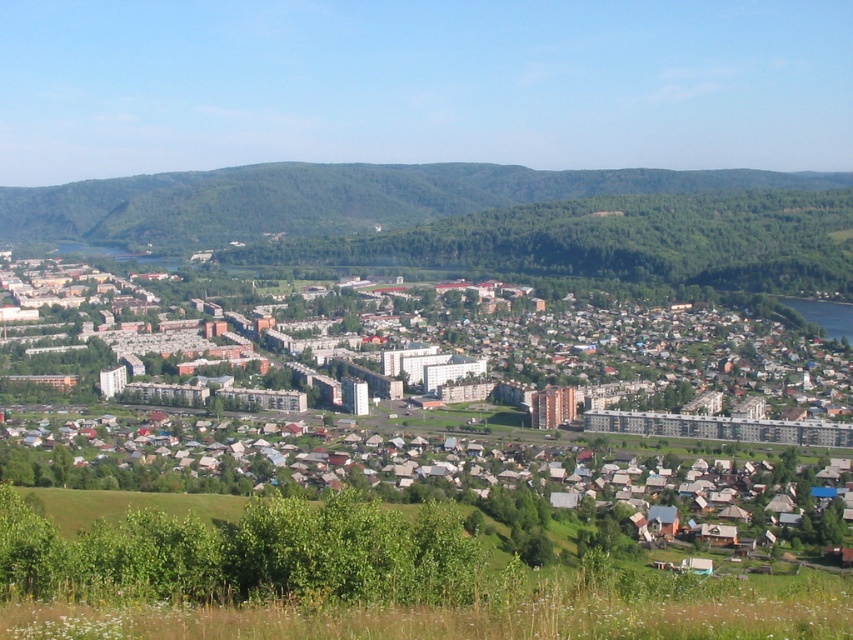
Who is taller, multicolored residential buildings at center or green forested mountain at upper center?

Standing taller between the two is multicolored residential buildings at center.

The height and width of the screenshot is (640, 853). What do you see at coordinates (466, 417) in the screenshot?
I see `multicolored residential buildings at center` at bounding box center [466, 417].

Who is more forward, (793,406) or (583,179)?

Point (793,406) is more forward.

The image size is (853, 640). Find the location of `multicolored residential buildings at center`. multicolored residential buildings at center is located at coordinates (466, 417).